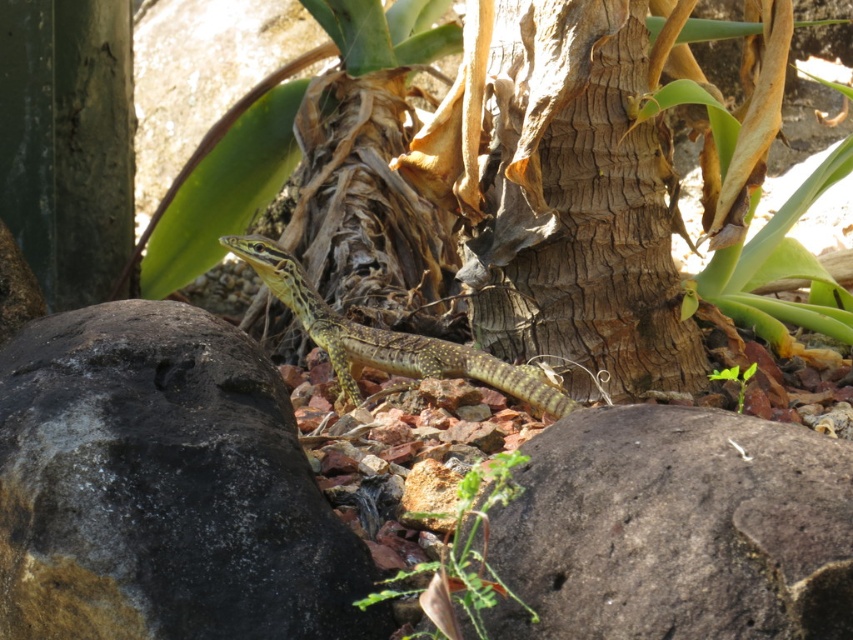
You are an artist sketching the scene. You need to decide which object to sketch first based on their size. Which one should you start with, the rough textured rock at lower right or the brown rough bark at center?

The brown rough bark at center occupies more space than the rough textured rock at lower right, so you should start sketching the brown rough bark at center first as it is larger.

You are a hiker who wants to take a photo of the green leafy plant at lower center without blocking the brown rough bark at center in the background. Is this possible given their positions?

The brown rough bark at center is further to the viewer than the green leafy plant at lower center, so the green leafy plant at lower center is closer to you. This means you can position yourself so that the green leafy plant at lower center is in the foreground while the brown rough bark at center is behind it, but since the brown rough bark at center is closer to you, it might still block the view unless you move to the side or adjust your angle.